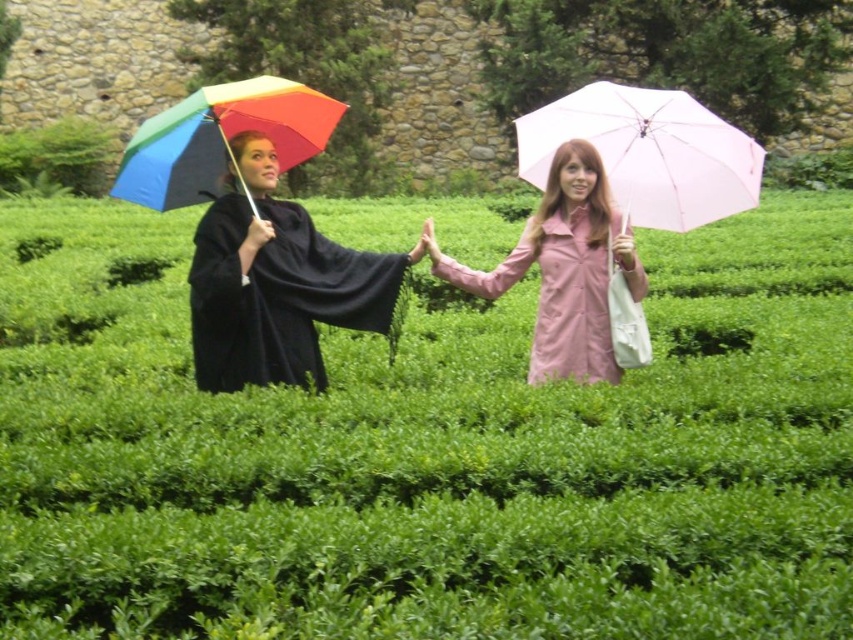
Consider the image. Which is more to the left, rainbow fabric umbrella at left or green leafy hedge at left?

Positioned to the left is green leafy hedge at left.

Image resolution: width=853 pixels, height=640 pixels. In order to click on rainbow fabric umbrella at left in this screenshot , I will do (221, 140).

Is black matte cape at left thinner than pink matte trench coat at center?

No, black matte cape at left is not thinner than pink matte trench coat at center.

Is black matte cape at left taller than pink matte trench coat at center?

In fact, black matte cape at left may be shorter than pink matte trench coat at center.

You are a GUI agent. You are given a task and a screenshot of the screen. Output one action in this format:
    pyautogui.click(x=<x>, y=<y>)
    Task: Click on the black matte cape at left
    This screenshot has height=640, width=853.
    Given the screenshot: What is the action you would take?
    pyautogui.click(x=277, y=296)

The image size is (853, 640). What are the coordinates of `black matte cape at left` in the screenshot? It's located at (277, 296).

Looking at this image, is matte black cape at left below pink matte umbrella at center?

Indeed, matte black cape at left is positioned under pink matte umbrella at center.

Which is behind, point (329, 244) or point (546, 131)?

Point (546, 131)

Find the location of a particular element. matte black cape at left is located at coordinates (286, 284).